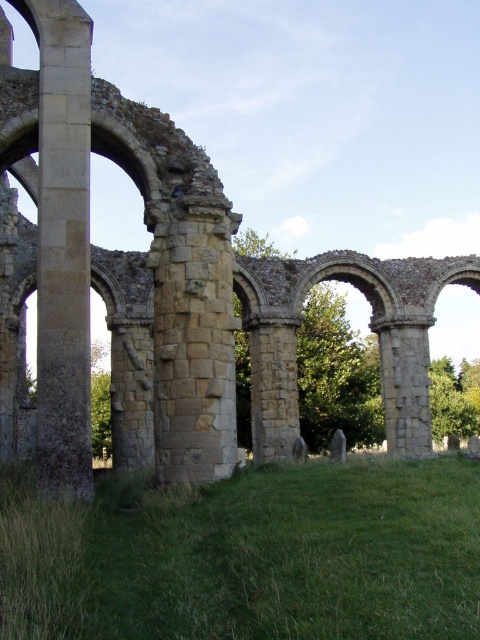
You are standing at the ruins of an ancient stone structure. You see two points marked in the image. The first point is at coordinates point (0, 536) and the second point is at point (76, 496). From your perspective, which point is closer to you?

Point (0, 536) is in front of point (76, 496), so it is closer to you.

You are an archaeologist examining the ruins. You notice the green grass at lower center and the smooth stone pillar at left. Which object is larger in size?

The smooth stone pillar at left is larger than the green grass at lower center.

You are a gardener tasked with mowing the green grass at lower center and trimming the smooth stone pillar at left. Which object requires a wider path for the lawnmower to maneuver around?

The green grass at lower center requires a wider path for the lawnmower to maneuver around since it is wider than the smooth stone pillar at left.